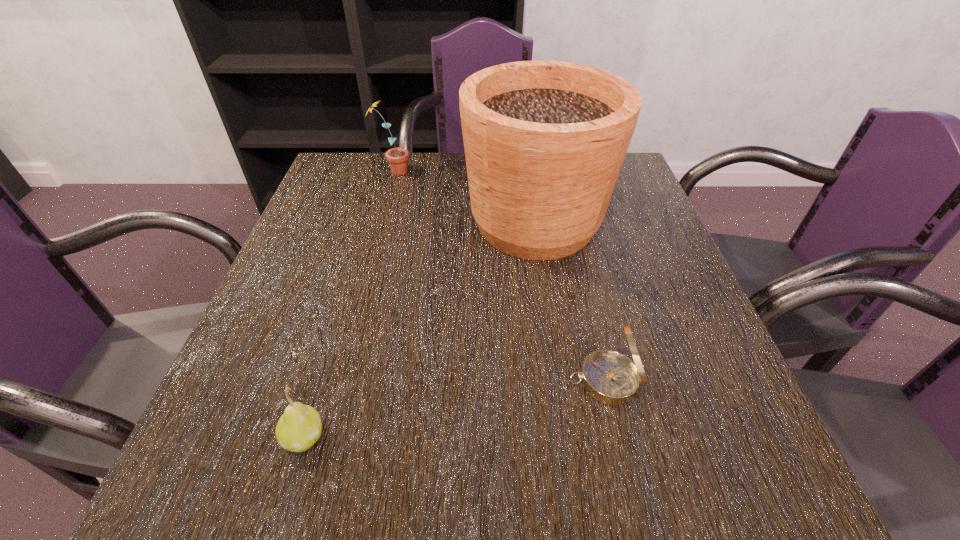
The height and width of the screenshot is (540, 960). Identify the location of object at the near left corner. (299, 428).

Where is `object that is positioned at the far right corner`? object that is positioned at the far right corner is located at coordinates (544, 141).

I want to click on vacant space at the far edge of the desktop, so click(433, 159).

Where is `free region at the near edge of the desktop`? The width and height of the screenshot is (960, 540). free region at the near edge of the desktop is located at coordinates (421, 471).

The image size is (960, 540). In the image, there is a desktop. Identify the location of vacant region at the left edge. [286, 314].

Locate an element on the screen. The image size is (960, 540). vacant position at the right edge of the desktop is located at coordinates (656, 229).

Where is `vacant space at the far left corner of the desktop`? vacant space at the far left corner of the desktop is located at coordinates pos(331,164).

Identify the location of blank area at the near right corner. The image size is (960, 540). (701, 457).

Where is `vacant region between the third farthest object and the flowerpot`? This screenshot has width=960, height=540. vacant region between the third farthest object and the flowerpot is located at coordinates (570, 301).

The image size is (960, 540). I want to click on vacant space that's between the nearest object and the third nearest object, so [x=420, y=329].